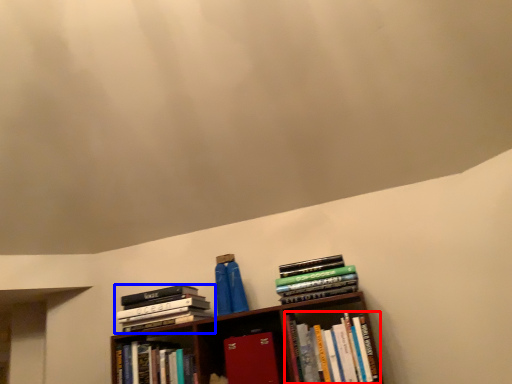
Question: Which object is further to the camera taking this photo, book (highlighted by a red box) or book (highlighted by a blue box)?

Choices:
 (A) book
 (B) book

Answer: (B)